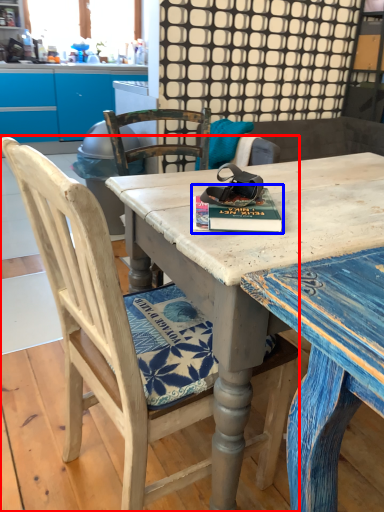
Question: Which object is closer to the camera taking this photo, chair (highlighted by a red box) or paperback book (highlighted by a blue box)?

Choices:
 (A) chair
 (B) paperback book

Answer: (A)